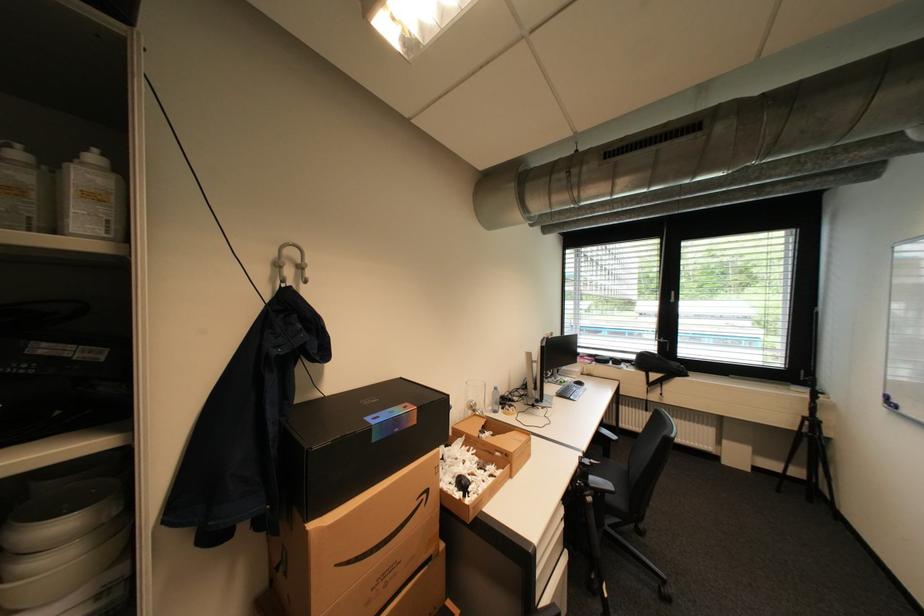
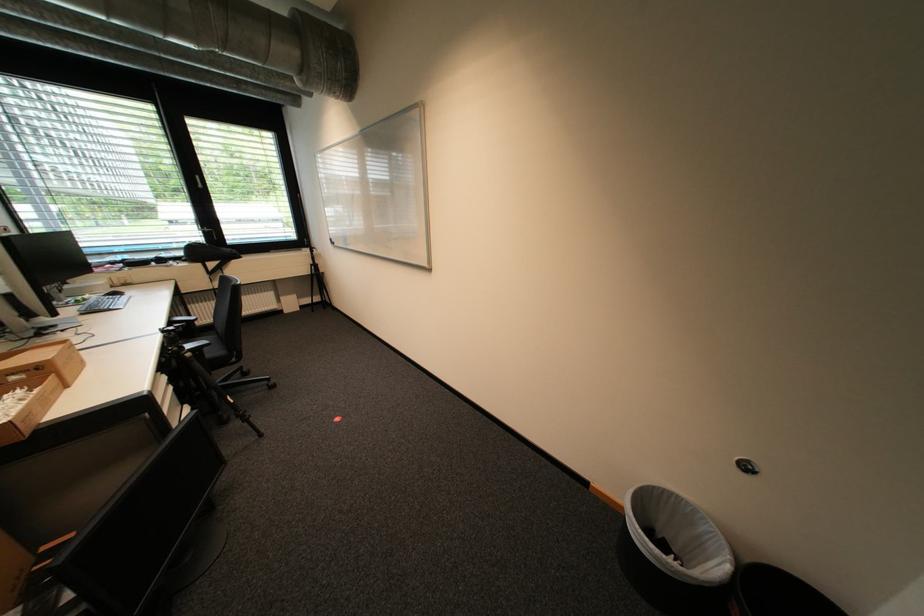
Find the pixel in the second image that matches the point at 600,463 in the first image.

(184, 328)